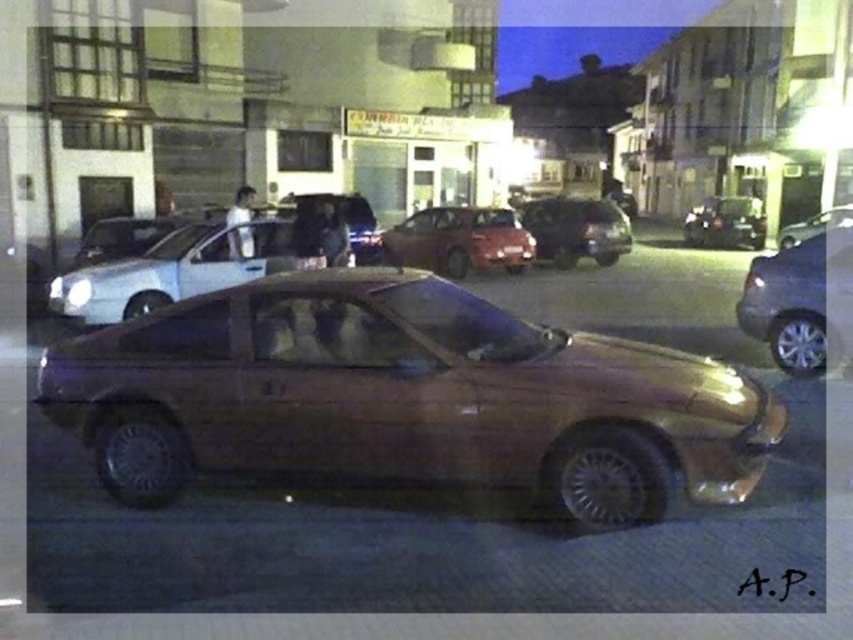
You are a delivery driver who needs to park your truck between the gold metallic car at center and the satin gold car at center. Your truck is 10 meters long. Can you fit your truck between them without overlapping either car?

The gold metallic car at center and the satin gold car at center are 14.74 meters apart from each other. Since your truck is 10 meters long, there is enough space between them to park without overlapping either car.

You are a delivery person trying to park your 1.8 meters tall delivery box in the space between the gold metallic car at center and the black plastic license plate at center. Can the delivery box fit vertically between them?

The gold metallic car at center is much taller than the black plastic license plate at center, so the vertical space between them would be insufficient for the 1.8 meters tall delivery box to fit.